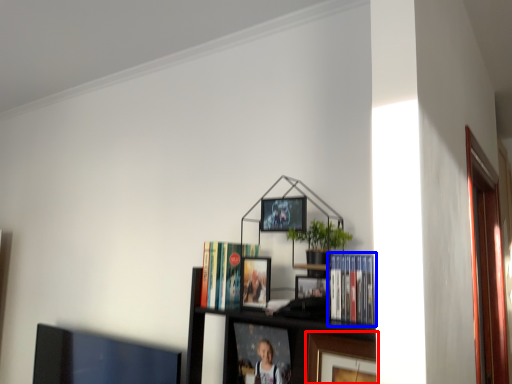
Question: Which object appears closest to the camera in this image, picture frame (highlighted by a red box) or book (highlighted by a blue box)?

Choices:
 (A) picture frame
 (B) book

Answer: (B)